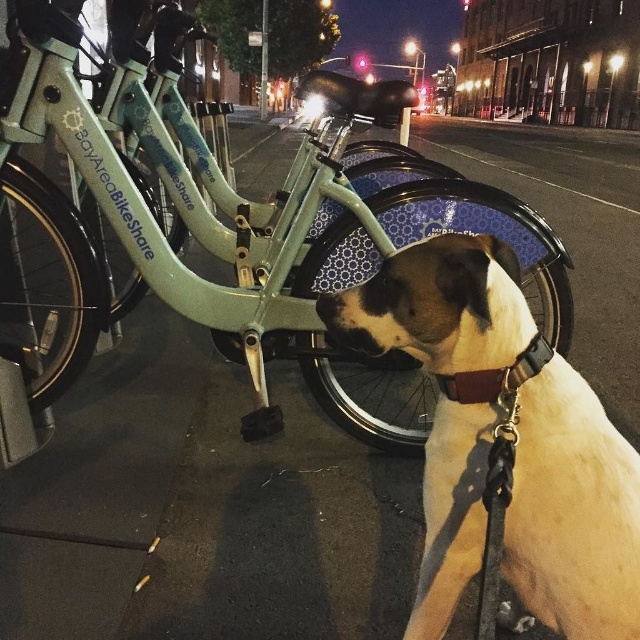
Consider the image. Which of these two, white fur dog at center or black rubber nose at center, stands taller?

white fur dog at center is taller.

Measure the distance between point (625, 456) and camera.

The distance of point (625, 456) from camera is 3.29 feet.

Where is `white fur dog at center`? white fur dog at center is located at coordinates (572, 515).

The width and height of the screenshot is (640, 640). Identify the location of matte green bicycle at center. (234, 228).

Is matte green bicycle at center behind white fur dog at center?

Yes, matte green bicycle at center is further from the viewer.

Does point (120, 106) come closer to viewer compared to point (534, 460)?

No.

This screenshot has width=640, height=640. Identify the location of matte green bicycle at center. (234, 228).

Between matte green bicycle at center and black rubber nose at center, which one appears on the left side from the viewer's perspective?

From the viewer's perspective, matte green bicycle at center appears more on the left side.

How far apart are matte green bicycle at center and black rubber nose at center?

matte green bicycle at center is 4.75 feet away from black rubber nose at center.

Describe the element at coordinates (234, 228) in the screenshot. This screenshot has width=640, height=640. I see `matte green bicycle at center` at that location.

I want to click on matte green bicycle at center, so click(234, 228).